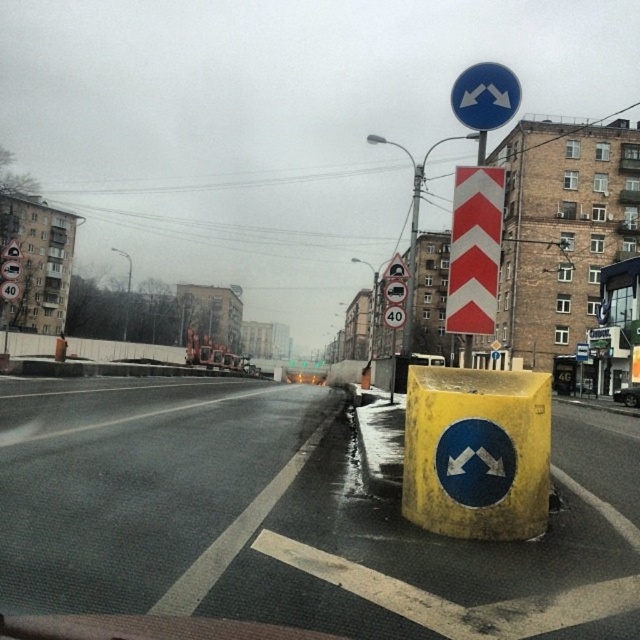
Question: Estimate the real-world distances between objects in this image. Which object is closer to the white reflective chevron at center?

Choices:
 (A) metallic rectangular sign at center
 (B) white plastic speed limit sign at center

Answer: (A)

Question: Is white reflective chevron at center wider than white glossy arrow at lower right?

Choices:
 (A) yes
 (B) no

Answer: (A)

Question: Which point is farther to the camera?

Choices:
 (A) (496, 90)
 (B) (451, 310)
 (C) (449, 465)
 (D) (397, 308)

Answer: (D)

Question: Is white reflective chevron at center bigger than metallic rectangular sign at center?

Choices:
 (A) yes
 (B) no

Answer: (A)

Question: Is white glossy arrow at lower right above white plastic speed limit sign at center?

Choices:
 (A) no
 (B) yes

Answer: (A)

Question: Which of the following is the farthest from the observer?

Choices:
 (A) white glossy arrow at lower right
 (B) metallic rectangular sign at center
 (C) white reflective chevron at center

Answer: (B)